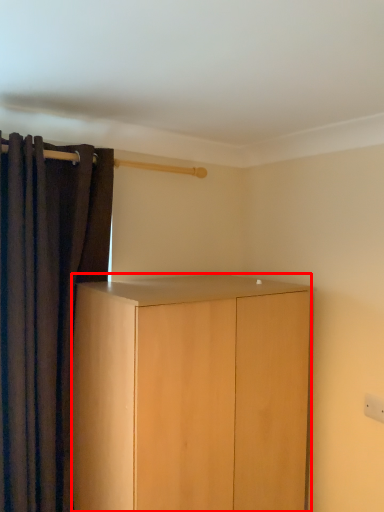
Question: Considering the relative positions of cabinetry (annotated by the red box) and curtain in the image provided, where is cabinetry (annotated by the red box) located with respect to the staircase?

Choices:
 (A) right
 (B) left

Answer: (A)